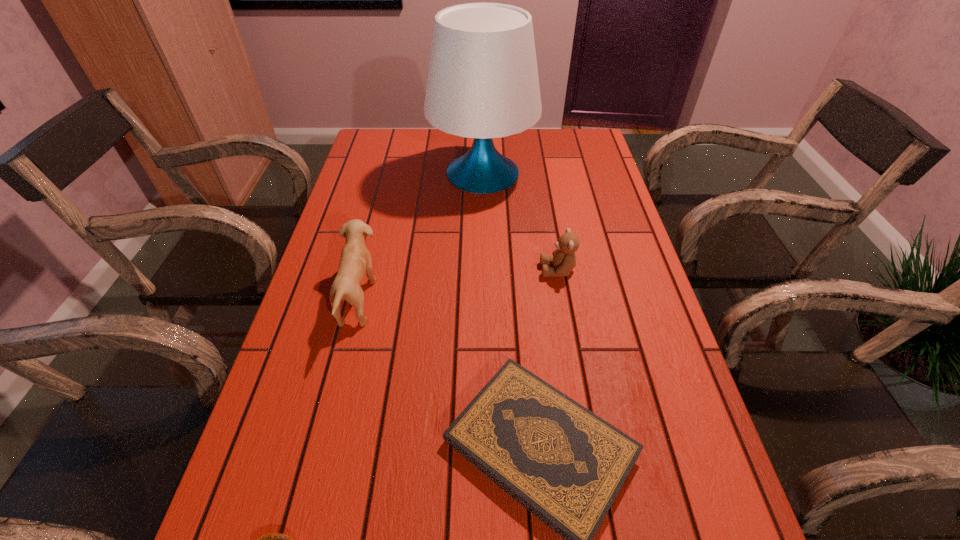
At what (x,y) coordinates should I click in order to perform the action: click on free region located on the front-facing side of the third shortest object. Please return your answer as a coordinate pair (x, y). Looking at the image, I should click on (484, 270).

You are a GUI agent. You are given a task and a screenshot of the screen. Output one action in this format:
    pyautogui.click(x=<x>, y=<y>)
    Task: Click on the object that is at the far edge
    This screenshot has height=540, width=960.
    Given the screenshot: What is the action you would take?
    pyautogui.click(x=482, y=83)

Locate an element on the screen. Image resolution: width=960 pixels, height=540 pixels. object located at the left edge is located at coordinates (355, 261).

Identify the location of vacant space at the far edge of the desktop. (529, 153).

The height and width of the screenshot is (540, 960). In the image, there is a desktop. In order to click on free region at the left edge in this screenshot , I will do `click(331, 322)`.

The height and width of the screenshot is (540, 960). I want to click on vacant space at the right edge, so click(x=618, y=247).

Where is `vacant point at the far left corner`? This screenshot has width=960, height=540. vacant point at the far left corner is located at coordinates (400, 132).

Locate an element on the screen. This screenshot has width=960, height=540. free region at the far right corner is located at coordinates (575, 148).

Identify the location of free spot between the tallest object and the puppy. (420, 237).

The height and width of the screenshot is (540, 960). In order to click on vacant region between the third tallest object and the second tallest object in this screenshot , I will do `click(458, 285)`.